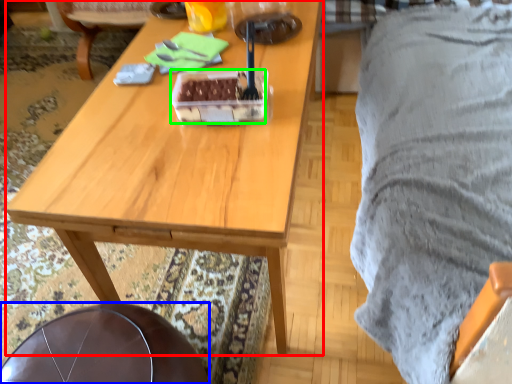
Question: Estimate the real-world distances between objects in this image. Which object is closer to desk (highlighted by a red box), chair (highlighted by a blue box) or food (highlighted by a green box)?

Choices:
 (A) chair
 (B) food

Answer: (B)